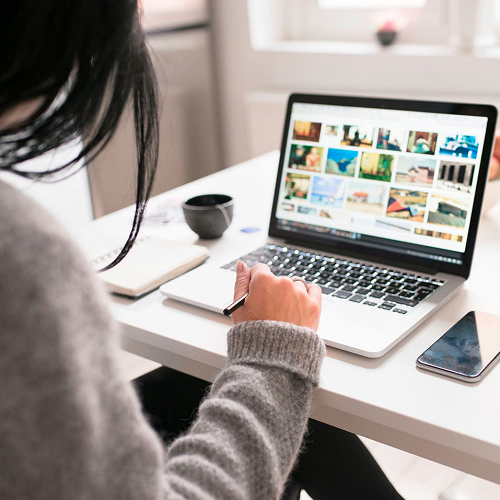
The image size is (500, 500). I want to click on laptop, so click(413, 182).